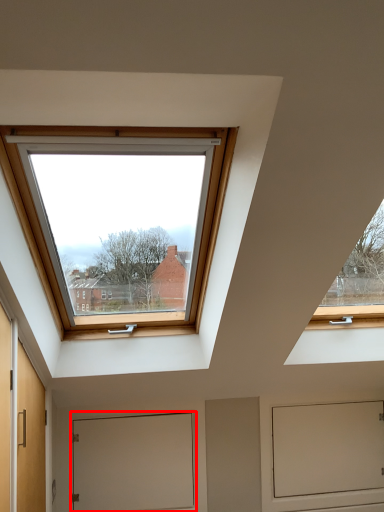
Question: Where is door (annotated by the red box) located in relation to screen door in the image?

Choices:
 (A) right
 (B) left

Answer: (B)